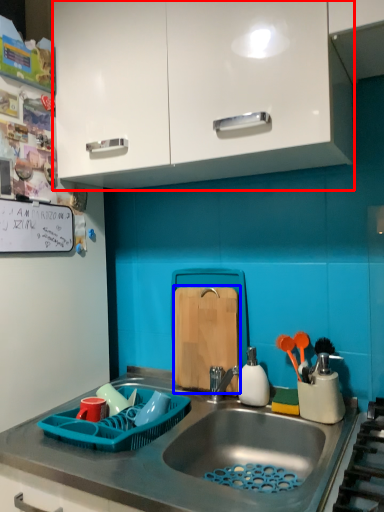
Question: Among these objects, which one is nearest to the camera, cabinetry (highlighted by a red box) or cutting board (highlighted by a blue box)?

Choices:
 (A) cabinetry
 (B) cutting board

Answer: (A)